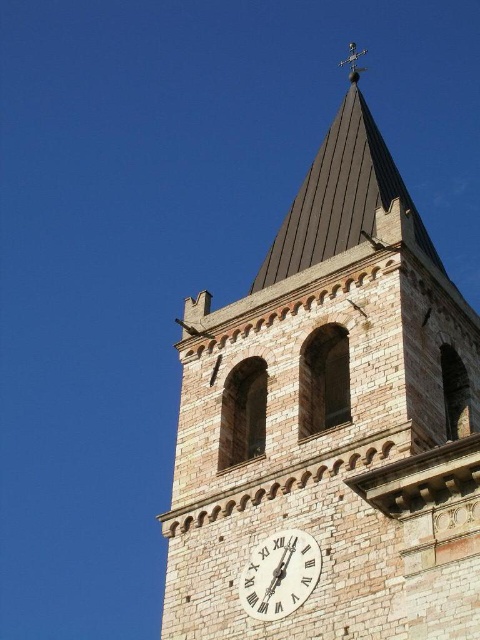
You are an architect planning to install a new decorative element on the brown stone clock tower at upper center and the white stone clock at center. The decorative element requires a minimum width of 2 meters to be securely attached. Given the widths of both objects, which one is more suitable for the installation?

The brown stone clock tower at upper center has a greater width than the white stone clock at center, so it is more suitable for the installation of the decorative element requiring a minimum of 2 meters.

You are a maintenance worker needing to reach both the brown stone clock tower at upper center and the white stone clock at center for repairs. The ladder you have can only extend to 6 meters. Can you safely reach both objects with the ladder you have?

The brown stone clock tower at upper center and white stone clock at center are 6.86 meters apart from each other. Since the ladder can only extend to 6 meters, it is not long enough to safely reach both objects.

You are standing in front of the historic stone tower and notice a point marked at coordinates (333, 417). Based on the scene description, can you determine which structure this point is located on?

The point marked at coordinates (333, 417) is located on the brown stone clock tower at upper center.